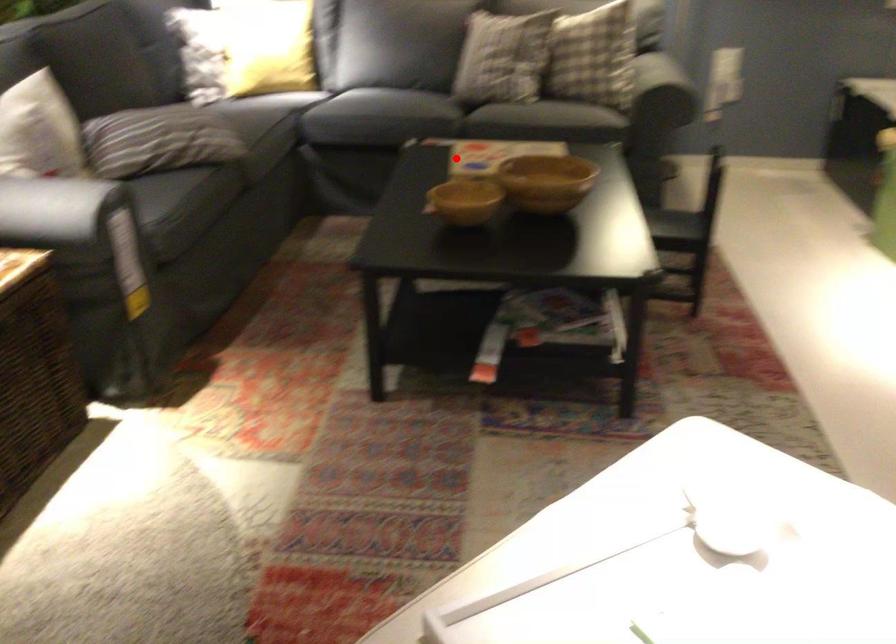
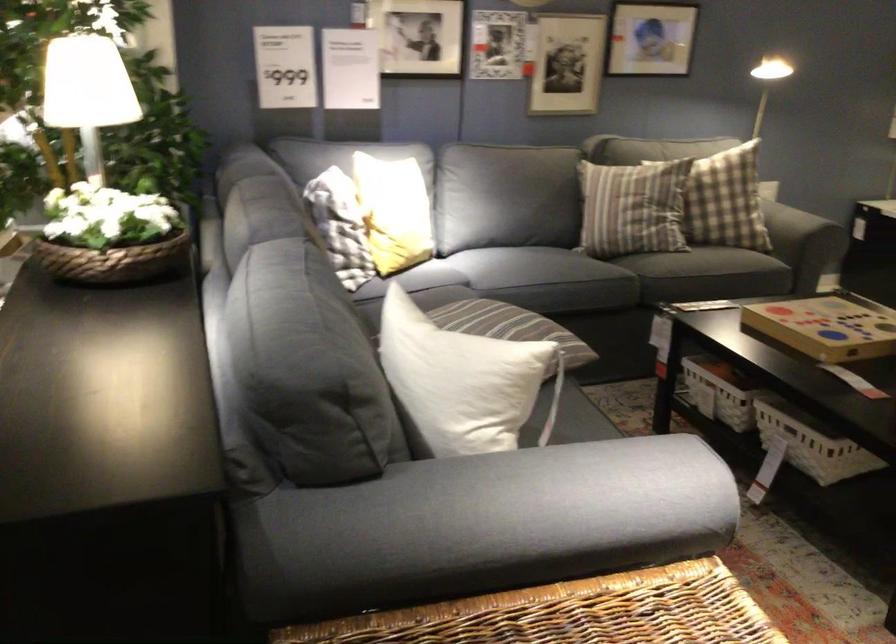
Where in the second image is the point corresponding to the highlighted location from the first image?

(828, 326)